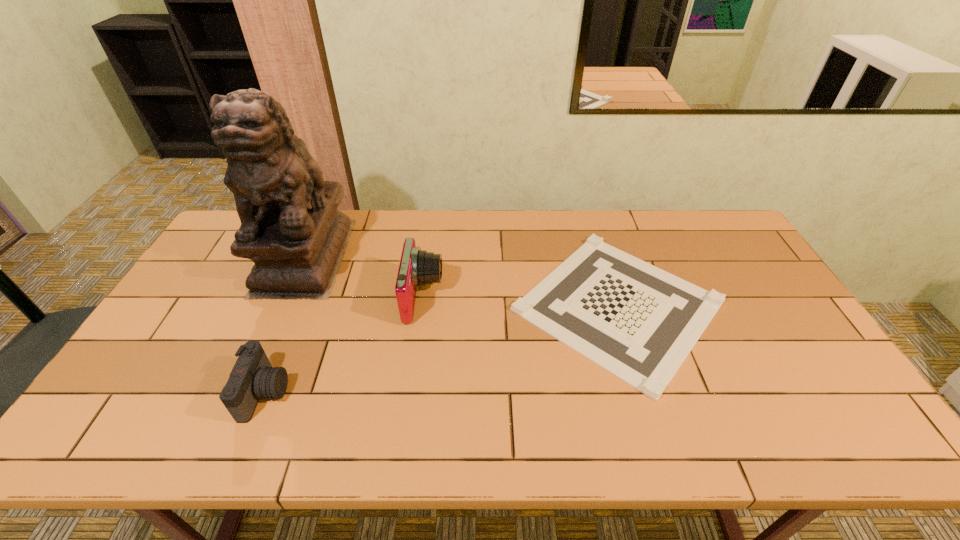
The width and height of the screenshot is (960, 540). In order to click on vacant area in the image that satisfies the following two spatial constraints: 1. on the front-facing side of the right camera; 2. on the back side of the checkerboard in this screenshot , I will do `click(422, 305)`.

Locate an element on the screen. The height and width of the screenshot is (540, 960). free location that satisfies the following two spatial constraints: 1. on the front-facing side of the rightmost object; 2. on the right side of the second tallest object is located at coordinates (422, 305).

Locate an element on the screen. vacant space that satisfies the following two spatial constraints: 1. on the front-facing side of the tallest object; 2. on the right side of the rightmost object is located at coordinates (283, 305).

Locate an element on the screen. This screenshot has width=960, height=540. free space in the image that satisfies the following two spatial constraints: 1. on the front-facing side of the checkerboard; 2. on the left side of the farther camera is located at coordinates (422, 305).